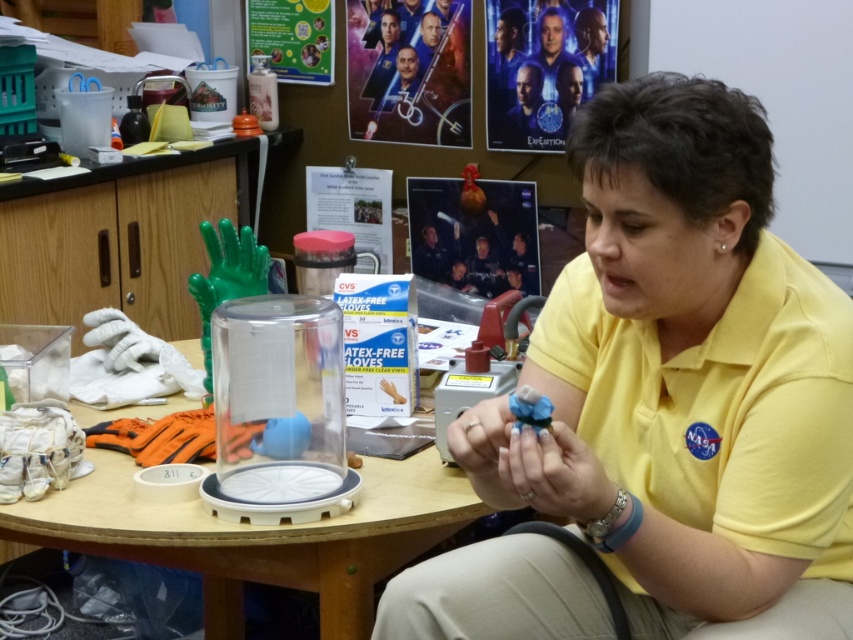
Which is more to the right, yellow fabric shirt at center or clear plastic table at center?

yellow fabric shirt at center

The width and height of the screenshot is (853, 640). Identify the location of yellow fabric shirt at center. tap(701, 368).

Find the location of a particular element. Image resolution: width=853 pixels, height=640 pixels. yellow fabric shirt at center is located at coordinates (701, 368).

Is clear plastic table at center below blue matte object at center?

Yes.

Between clear plastic table at center and blue matte object at center, which one is positioned higher?

blue matte object at center

Between point (207, 540) and point (566, 461), which one is positioned behind?

The point (207, 540) is more distant.

Find the location of a particular element. The width and height of the screenshot is (853, 640). clear plastic table at center is located at coordinates (260, 536).

Is yellow fabric shirt at center smaller than blue matte object at center?

Incorrect, yellow fabric shirt at center is not smaller in size than blue matte object at center.

Find the location of a particular element. yellow fabric shirt at center is located at coordinates [x=701, y=368].

Between point (830, 308) and point (505, 499), which one is positioned behind?

Positioned behind is point (505, 499).

Find the location of a particular element. yellow fabric shirt at center is located at coordinates (x=701, y=368).